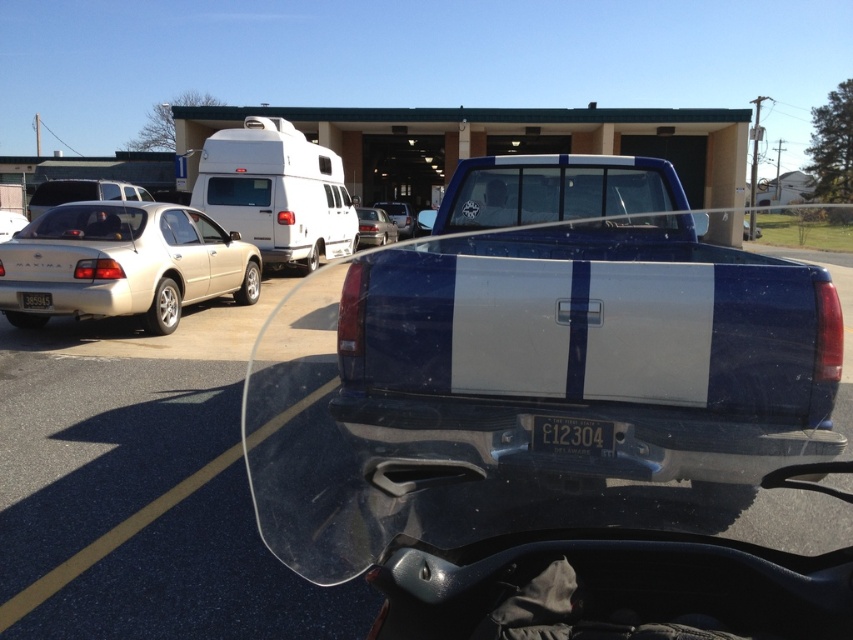
Who is higher up, metallic blue truck at center or white plastic license plate at rear?

metallic blue truck at center

At what (x,y) coordinates should I click in order to perform the action: click on metallic blue truck at center. Please return your answer as a coordinate pair (x, y). This screenshot has width=853, height=640. Looking at the image, I should click on (341, 468).

Identify the location of metallic blue truck at center. (341, 468).

Who is positioned more to the left, yellow matte license plate at center or silver metallic sedan at center?

silver metallic sedan at center is more to the left.

This screenshot has height=640, width=853. What do you see at coordinates (572, 435) in the screenshot?
I see `yellow matte license plate at center` at bounding box center [572, 435].

Find the location of a particular element. yellow matte license plate at center is located at coordinates (572, 435).

Between point (538, 426) and point (38, 300), which one is positioned in front?

Point (538, 426) is in front.

Is point (547, 449) positioned after point (45, 305)?

No, (547, 449) is in front of (45, 305).

In the scene shown: Who is more forward, (595, 456) or (25, 305)?

Point (595, 456) is in front.

Where is `yellow matte license plate at center`? The height and width of the screenshot is (640, 853). yellow matte license plate at center is located at coordinates (572, 435).